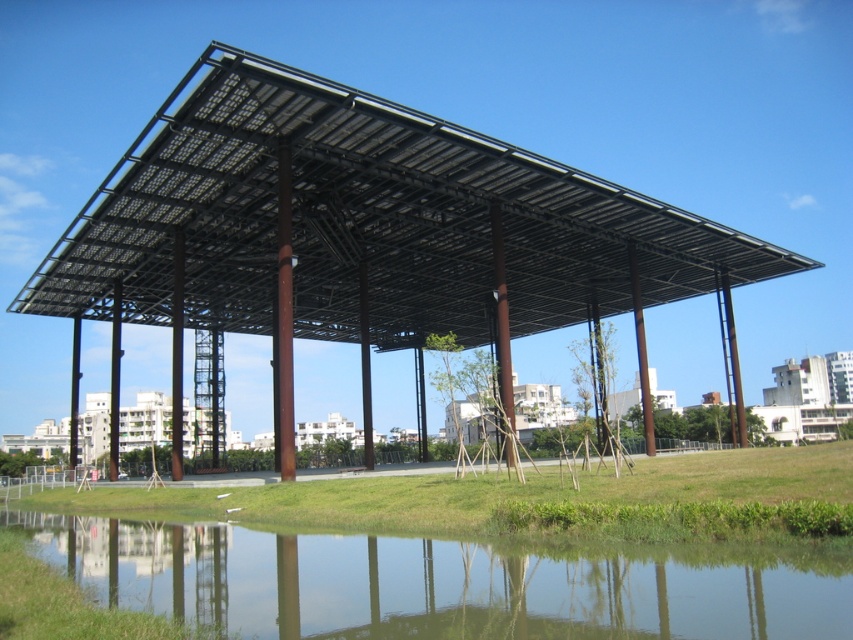
Question: Does black metal roof at center have a greater width compared to clear water at lower center?

Choices:
 (A) no
 (B) yes

Answer: (B)

Question: Among these objects, which one is nearest to the camera?

Choices:
 (A) clear water at lower center
 (B) black metal roof at center

Answer: (A)

Question: Can you confirm if black metal roof at center is positioned below clear water at lower center?

Choices:
 (A) no
 (B) yes

Answer: (A)

Question: Which point is closer to the camera taking this photo?

Choices:
 (A) (212, 314)
 (B) (839, 573)

Answer: (B)

Question: Does black metal roof at center appear on the right side of clear water at lower center?

Choices:
 (A) no
 (B) yes

Answer: (B)